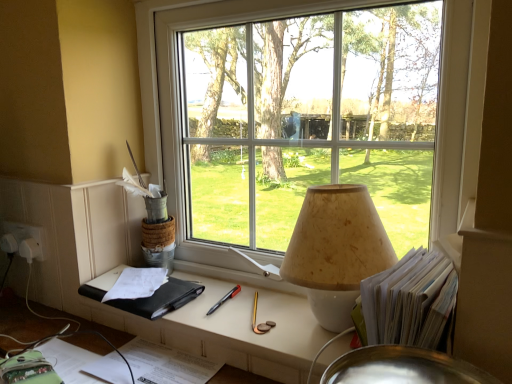
Question: Considering the relative positions of black leather notebook at lower left and transparent glass window at center in the image provided, is black leather notebook at lower left to the left of transparent glass window at center from the viewer's perspective?

Choices:
 (A) yes
 (B) no

Answer: (A)

Question: Is black leather notebook at lower left turned away from transparent glass window at center?

Choices:
 (A) no
 (B) yes

Answer: (B)

Question: From a real-world perspective, does black leather notebook at lower left stand above transparent glass window at center?

Choices:
 (A) yes
 (B) no

Answer: (B)

Question: Can you confirm if black leather notebook at lower left is bigger than transparent glass window at center?

Choices:
 (A) yes
 (B) no

Answer: (B)

Question: From a real-world perspective, is black leather notebook at lower left positioned under transparent glass window at center based on gravity?

Choices:
 (A) no
 (B) yes

Answer: (B)

Question: Would you say beige textured lampshade at center is inside or outside transparent glass window at center?

Choices:
 (A) inside
 (B) outside

Answer: (B)

Question: From a real-world perspective, relative to transparent glass window at center, is beige textured lampshade at center vertically above or below?

Choices:
 (A) below
 (B) above

Answer: (A)

Question: Considering the positions of beige textured lampshade at center and transparent glass window at center in the image, is beige textured lampshade at center wider or thinner than transparent glass window at center?

Choices:
 (A) wide
 (B) thin

Answer: (A)

Question: In terms of size, does beige textured lampshade at center appear bigger or smaller than transparent glass window at center?

Choices:
 (A) small
 (B) big

Answer: (A)

Question: From the image's perspective, is beige textured lampshade at center located above or below matte black book at center?

Choices:
 (A) above
 (B) below

Answer: (A)

Question: From a real-world perspective, is beige textured lampshade at center physically located above or below matte black book at center?

Choices:
 (A) below
 (B) above

Answer: (B)

Question: Is beige textured lampshade at center to the left or to the right of matte black book at center in the image?

Choices:
 (A) left
 (B) right

Answer: (B)

Question: Is point (372, 236) closer or farther from the camera than point (218, 324)?

Choices:
 (A) farther
 (B) closer

Answer: (B)

Question: Relative to transparent glass window at center, is black leather notebook at lower left in front or behind?

Choices:
 (A) front
 (B) behind

Answer: (B)

Question: From their relative heights in the image, would you say black leather notebook at lower left is taller or shorter than transparent glass window at center?

Choices:
 (A) short
 (B) tall

Answer: (A)